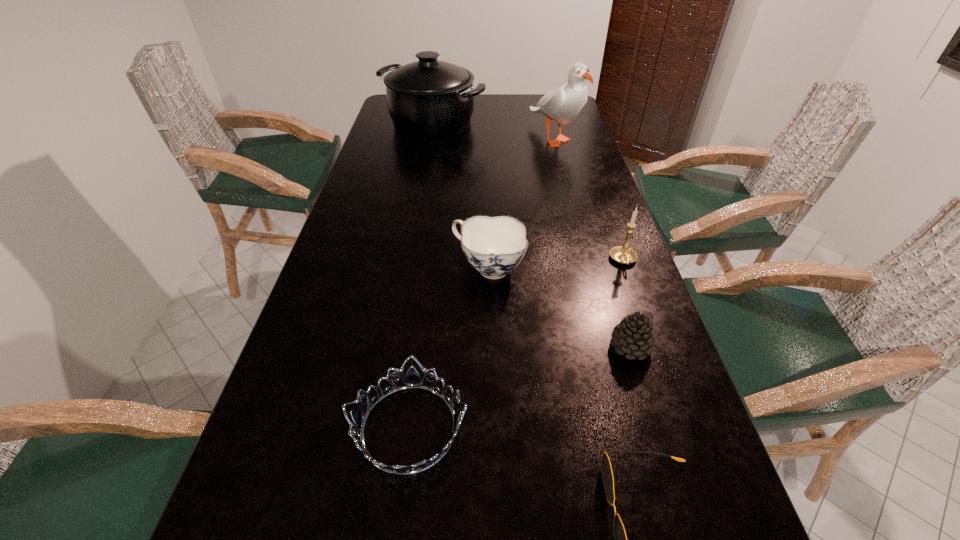
Identify the location of gull. (562, 105).

You are a GUI agent. You are given a task and a screenshot of the screen. Output one action in this format:
    pyautogui.click(x=<x>, y=<y>)
    Task: Click on the sixth shortest object
    
    Given the screenshot: What is the action you would take?
    pyautogui.click(x=429, y=99)

Locate an element on the screen. The height and width of the screenshot is (540, 960). the third tallest object is located at coordinates (623, 254).

Where is `the fourth tallest object`? This screenshot has width=960, height=540. the fourth tallest object is located at coordinates (494, 246).

The height and width of the screenshot is (540, 960). What are the coordinates of `the third nearest object` in the screenshot? It's located at (634, 335).

Locate an element on the screen. Image resolution: width=960 pixels, height=540 pixels. the third shortest object is located at coordinates (634, 335).

I want to click on the second shortest object, so click(x=412, y=380).

What are the coordinates of `vacant space located at the beak of the gull` in the screenshot? It's located at (579, 225).

The image size is (960, 540). I want to click on free point located 0.270m on the right of the saucepan, so click(x=557, y=123).

Identify the location of free space located 0.200m on the handle side of the third tallest object. Image resolution: width=960 pixels, height=540 pixels. (651, 338).